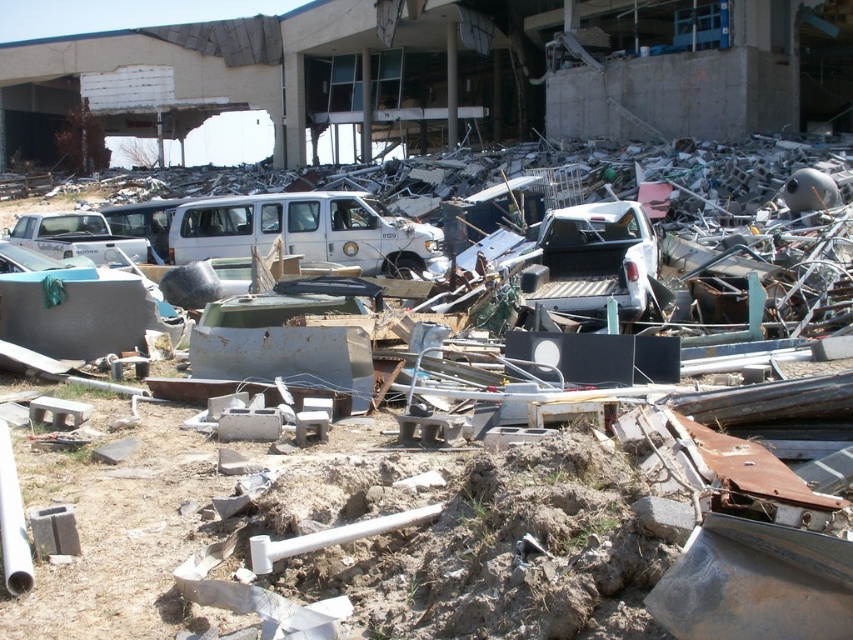
Question: Does white matte van at center have a larger size compared to matte white truck at left?

Choices:
 (A) yes
 (B) no

Answer: (A)

Question: Which of these objects is positioned closest to the white matte truck at center?

Choices:
 (A) matte white truck at left
 (B) white matte van at center

Answer: (B)

Question: Can you confirm if white matte van at center is wider than white matte truck at center?

Choices:
 (A) yes
 (B) no

Answer: (A)

Question: Is white matte truck at center wider than matte white truck at left?

Choices:
 (A) yes
 (B) no

Answer: (B)

Question: Which point is closer to the camera?

Choices:
 (A) white matte truck at center
 (B) matte white truck at left
 (C) white matte van at center

Answer: (A)

Question: Which of these objects is positioned farthest from the matte white truck at left?

Choices:
 (A) white matte van at center
 (B) white matte truck at center

Answer: (B)